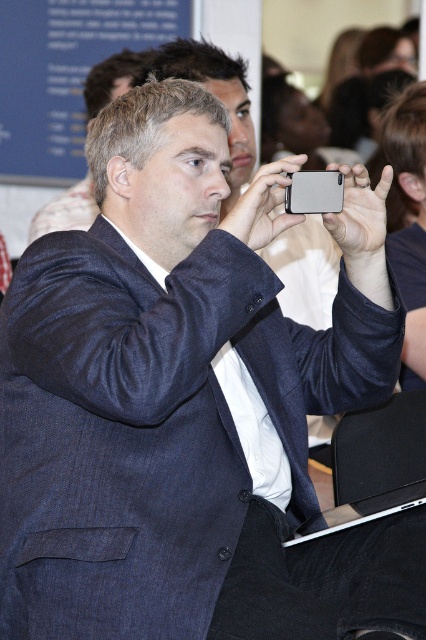
Question: Does dark blue textured suit at center have a greater width compared to dark blue suit at center?

Choices:
 (A) no
 (B) yes

Answer: (B)

Question: Which point is closer to the camera taking this photo?

Choices:
 (A) (13, 289)
 (B) (97, 68)

Answer: (A)

Question: Which point is farther to the camera?

Choices:
 (A) (402, 625)
 (B) (86, 209)

Answer: (B)

Question: Which of the following is the farthest from the observer?

Choices:
 (A) (16, 528)
 (B) (74, 220)

Answer: (B)

Question: Does dark blue textured suit at center lie behind dark blue suit at center?

Choices:
 (A) no
 (B) yes

Answer: (A)

Question: Observing the image, what is the correct spatial positioning of dark blue textured suit at center in reference to dark blue suit at center?

Choices:
 (A) above
 (B) below

Answer: (B)